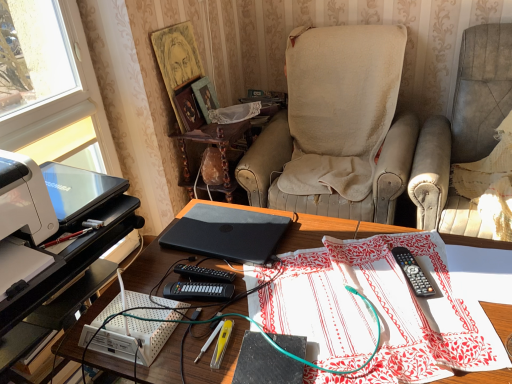
Image resolution: width=512 pixels, height=384 pixels. Find the location of `free location to the left of black plastic remote control at center, acting as the 2th stationery starting from the left`. free location to the left of black plastic remote control at center, acting as the 2th stationery starting from the left is located at coordinates (350, 284).